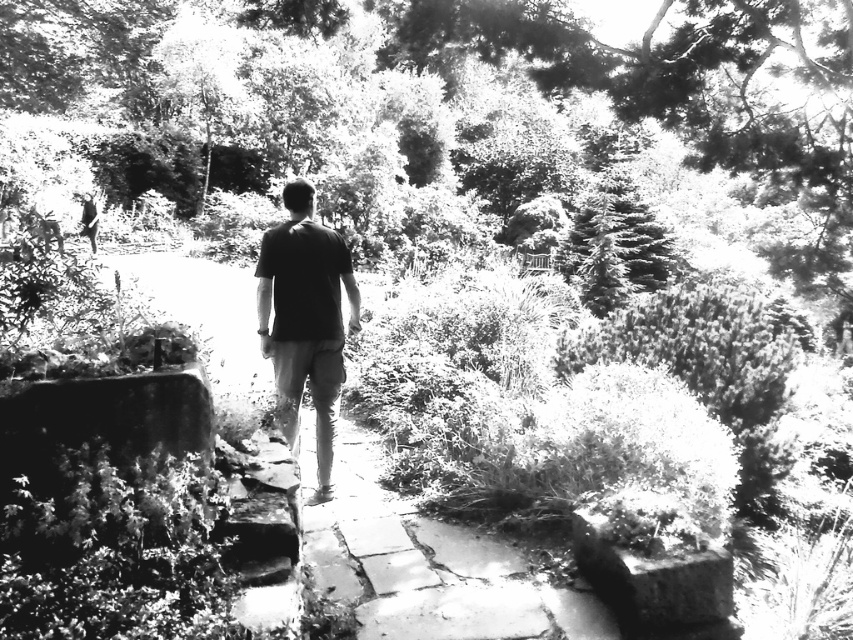
You are standing at the starting point of the stone pathway in the image. You see two points marked on the path ahead of you. The first point is at coordinates point (320, 232) and the second point is at point (606, 291). If you want to reach the point that is closer to you first, which coordinate should you head towards?

You should head towards point (320, 232) because it is closer to the viewer than point (606, 291).